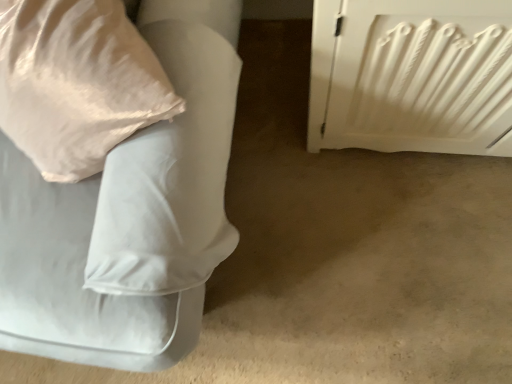
What is the approximate height of satin white pillow at left?

24.63 inches.

Image resolution: width=512 pixels, height=384 pixels. Describe the element at coordinates (128, 214) in the screenshot. I see `satin white pillow at left` at that location.

Where is `satin white pillow at left`? The image size is (512, 384). satin white pillow at left is located at coordinates (128, 214).

Where is `satin white pillow at left`? This screenshot has height=384, width=512. satin white pillow at left is located at coordinates (128, 214).